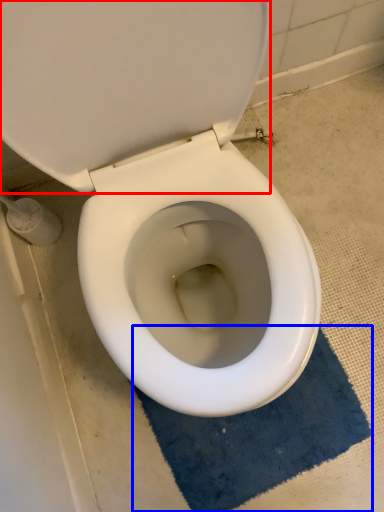
Question: Which object is closer to the camera taking this photo, back (highlighted by a red box) or bath mat (highlighted by a blue box)?

Choices:
 (A) back
 (B) bath mat

Answer: (B)